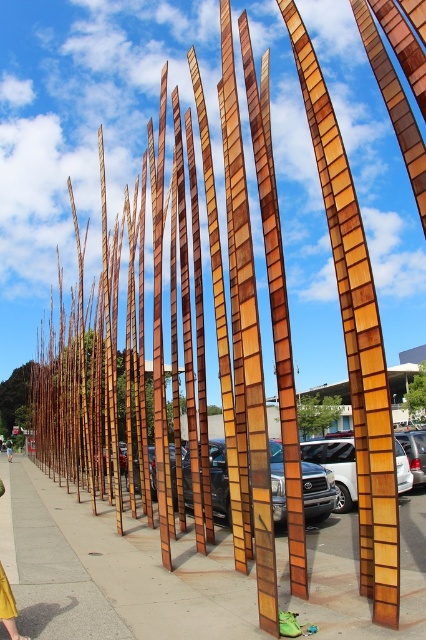
You are standing at the base of the architectural installation and want to locate two specific points marked in the image. The first point is at coordinates point (172,577) and the second is at point (9,438). From your current position, which point is closer to you?

Point (172,577) is in front of point (9,438), so it is closer to you.

You are standing on the smooth concrete sidewalk at center and want to walk to the green fabric person at lower center. Which direction should you move to reach them?

You should move to the left because the smooth concrete sidewalk at center is on the right side of the green fabric person at lower center, so moving left will bring you towards them.